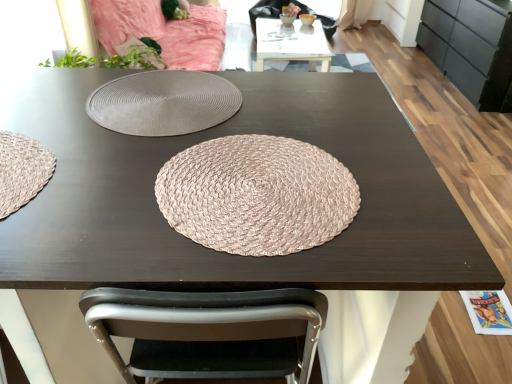
Locate an element on the screen. The height and width of the screenshot is (384, 512). empty space that is ontop of white glossy table at upper center (from a real-world perspective) is located at coordinates (285, 26).